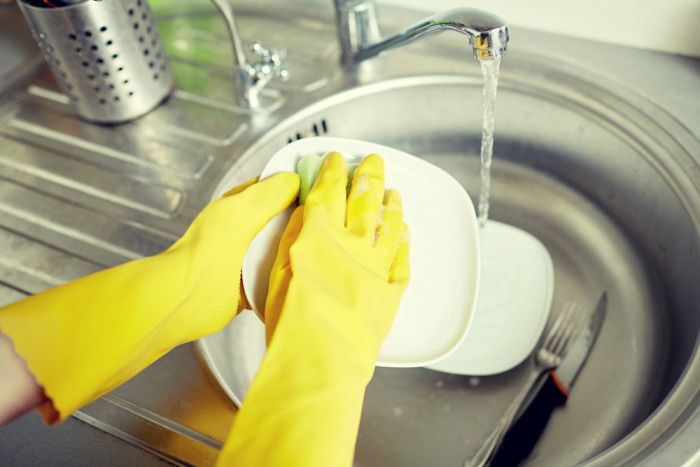
Identify the location of faucet. (462, 23).